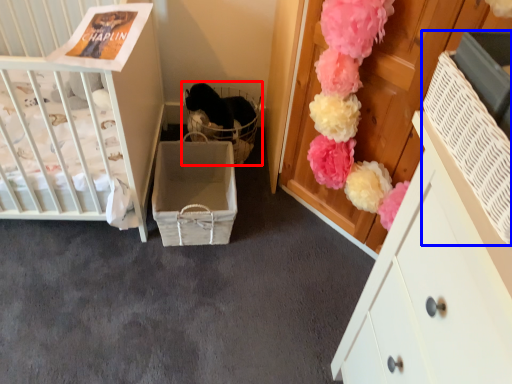
Question: Which object is further to the camera taking this photo, baby carriage (highlighted by a red box) or storage box (highlighted by a blue box)?

Choices:
 (A) baby carriage
 (B) storage box

Answer: (A)